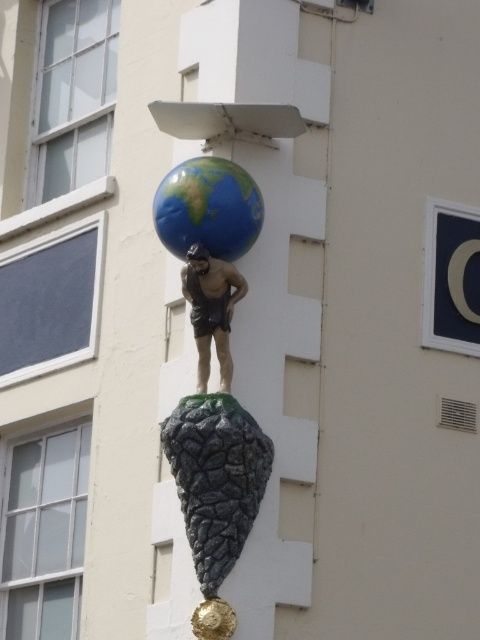
You are an art student analyzing the sculpture. You notice two points on the sculpture marked as point 1 at coordinates (172, 246) and point 2 at coordinates (233, 266). Based on their positions, which point is closer to the viewer?

Point 2 at coordinates (233, 266) is closer to the viewer because point 1 at coordinates (172, 246) is behind it.

You are an art curator planning to install a protective glass dome over the sculpture. The dome must accommodate both the polished stone globe at center and the matte bronze statue at center. Based on their sizes, which object requires the dome to have a larger diameter?

The polished stone globe at center is larger in size than the matte bronze statue at center, so the dome must have a diameter large enough to accommodate the polished stone globe at center.